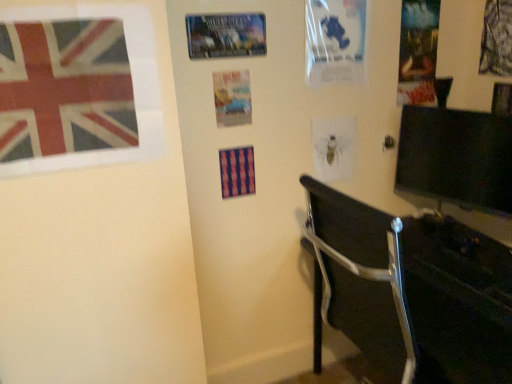
Question: Is printed fabric flag at upper left at the left side of metallic silver poster at upper center, marked as the first poster page in a left-to-right arrangement?

Choices:
 (A) no
 (B) yes

Answer: (B)

Question: Considering the relative sizes of printed fabric flag at upper left and metallic silver poster at upper center, which appears as the sixth poster page when viewed from the right, in the image provided, is printed fabric flag at upper left thinner than metallic silver poster at upper center, which appears as the sixth poster page when viewed from the right,?

Choices:
 (A) no
 (B) yes

Answer: (A)

Question: Does printed fabric flag at upper left have a greater width compared to metallic silver poster at upper center, marked as the first poster page in a left-to-right arrangement?

Choices:
 (A) yes
 (B) no

Answer: (A)

Question: From the image's perspective, would you say printed fabric flag at upper left is positioned over metallic silver poster at upper center, marked as the first poster page in a left-to-right arrangement?

Choices:
 (A) no
 (B) yes

Answer: (A)

Question: Is printed fabric flag at upper left aimed at metallic silver poster at upper center, which appears as the sixth poster page when viewed from the right?

Choices:
 (A) yes
 (B) no

Answer: (B)

Question: In terms of width, does translucent paper poster at center, the 3th poster page positioned from the right, look wider or thinner when compared to metallic silver chair at lower right?

Choices:
 (A) thin
 (B) wide

Answer: (A)

Question: Is translucent paper poster at center, the 3th poster page positioned from the right, to the left or to the right of metallic silver chair at lower right in the image?

Choices:
 (A) left
 (B) right

Answer: (A)

Question: Is point (330, 130) closer or farther from the camera than point (360, 339)?

Choices:
 (A) closer
 (B) farther

Answer: (A)

Question: From the image's perspective, relative to metallic silver chair at lower right, is translucent paper poster at center, the 3th poster page positioned from the right, above or below?

Choices:
 (A) below
 (B) above

Answer: (B)

Question: Visually, is black glossy monitor at right positioned to the left or to the right of transparent plastic poster at upper center, placed as the 4th poster page when sorted from right to left?

Choices:
 (A) left
 (B) right

Answer: (B)

Question: In terms of width, does black glossy monitor at right look wider or thinner when compared to transparent plastic poster at upper center, arranged as the third poster page when viewed from the left?

Choices:
 (A) thin
 (B) wide

Answer: (B)

Question: From the image's perspective, is black glossy monitor at right located above or below transparent plastic poster at upper center, arranged as the third poster page when viewed from the left?

Choices:
 (A) above
 (B) below

Answer: (B)

Question: Is black glossy monitor at right bigger or smaller than transparent plastic poster at upper center, arranged as the third poster page when viewed from the left?

Choices:
 (A) big
 (B) small

Answer: (A)

Question: Is point (192, 16) positioned closer to the camera than point (65, 127)?

Choices:
 (A) closer
 (B) farther

Answer: (B)

Question: Looking at their shapes, would you say metallic silver poster at upper center, which appears as the sixth poster page when viewed from the right, is wider or thinner than printed fabric flag at upper left?

Choices:
 (A) thin
 (B) wide

Answer: (A)